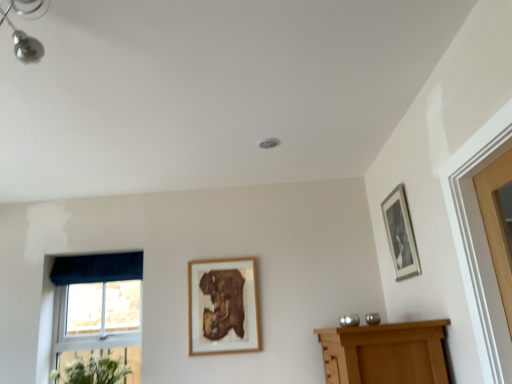
Question: In the image, is velvet dark blue curtain at left positioned in front of or behind wooden frame at center, the second picture frame viewed from the front?

Choices:
 (A) behind
 (B) front

Answer: (A)

Question: Is velvet dark blue curtain at left taller or shorter than wooden frame at center, the second picture frame viewed from the front?

Choices:
 (A) tall
 (B) short

Answer: (B)

Question: Considering the real-world distances, which object is closest to the silver metallic picture frame at upper right, the first picture frame positioned from the top?

Choices:
 (A) blue fabric window at lower left
 (B) wooden frame at center, the second picture frame viewed from the front
 (C) white matte flowers at lower left
 (D) velvet dark blue curtain at left

Answer: (B)

Question: Which object is positioned farthest from the wooden frame at center, acting as the first picture frame starting from the bottom?

Choices:
 (A) silver metallic picture frame at upper right, which is counted as the first picture frame, starting from the front
 (B) velvet dark blue curtain at left
 (C) blue fabric window at lower left
 (D) white matte flowers at lower left

Answer: (A)